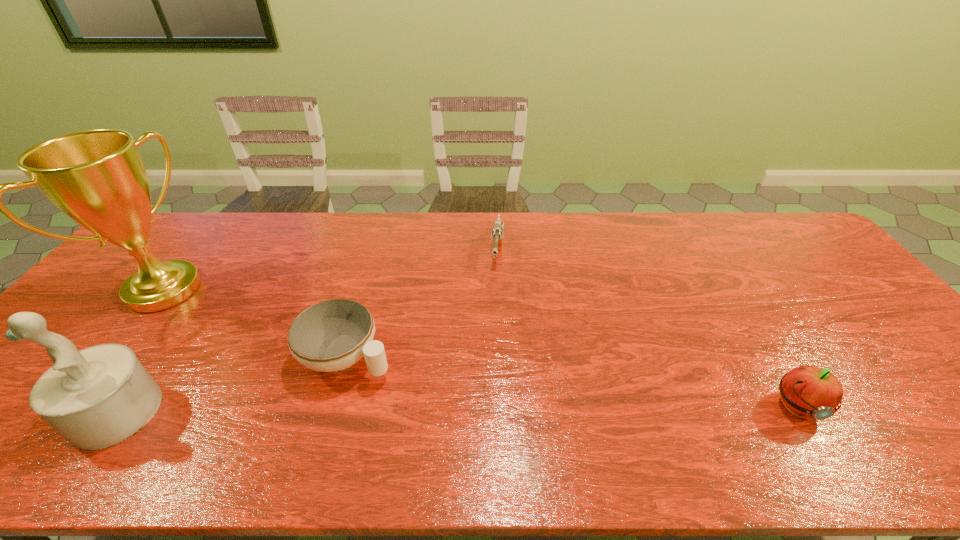
At what (x,y) coordinates should I click in order to perform the action: click on vacant space situated on the side with the handle of the third object from right to left. Please return your answer as a coordinate pair (x, y). The width and height of the screenshot is (960, 540). Looking at the image, I should click on (407, 385).

Where is `free space located on the side with the handle of the third object from right to left`? This screenshot has height=540, width=960. free space located on the side with the handle of the third object from right to left is located at coordinates (404, 383).

The height and width of the screenshot is (540, 960). I want to click on free spot located 0.070m on the side with the handle of the third object from right to left, so click(x=407, y=385).

At what (x,y) coordinates should I click in order to perform the action: click on vacant region located by the handles of the tallest object. Please return your answer as a coordinate pair (x, y). Looking at the image, I should click on (253, 349).

This screenshot has width=960, height=540. Find the location of `vacant space located by the handles of the tallest object`. vacant space located by the handles of the tallest object is located at coordinates (243, 343).

The image size is (960, 540). In order to click on free space located by the handles of the tallest object in this screenshot , I will do `click(230, 336)`.

The width and height of the screenshot is (960, 540). I want to click on object located in the far edge section of the desktop, so click(x=497, y=232).

I want to click on figurine that is at the near edge, so click(99, 396).

Find the location of a particular element. The image size is (960, 540). apple that is at the near edge is located at coordinates (810, 392).

At what (x,y) coordinates should I click in order to perform the action: click on chinaware that is positioned at the near edge. Please return your answer as a coordinate pair (x, y). Image resolution: width=960 pixels, height=540 pixels. Looking at the image, I should click on (332, 335).